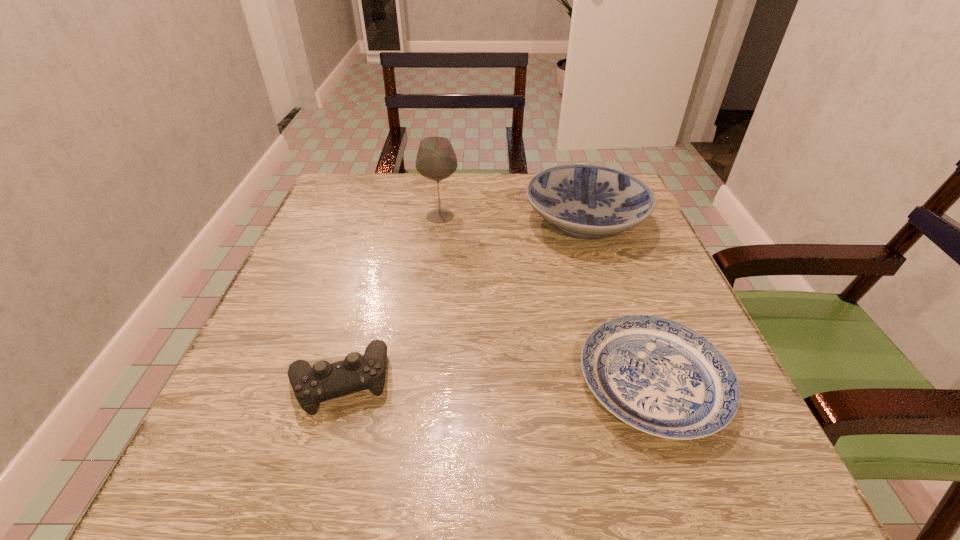
This screenshot has width=960, height=540. What are the coordinates of `free spot between the taller plate and the shortest object` in the screenshot? It's located at (619, 301).

The width and height of the screenshot is (960, 540). In order to click on unoccupied area between the control and the wineglass in this screenshot , I will do `click(390, 298)`.

I want to click on empty location between the third tallest object and the second tallest object, so click(462, 300).

Where is `vacant area that lies between the farther plate and the second shortest object`? This screenshot has width=960, height=540. vacant area that lies between the farther plate and the second shortest object is located at coordinates (462, 300).

Locate an element on the screen. object that can be found as the second closest to the shortest object is located at coordinates (312, 385).

Identify the location of object that stands as the closest to the second shortest object. (659, 376).